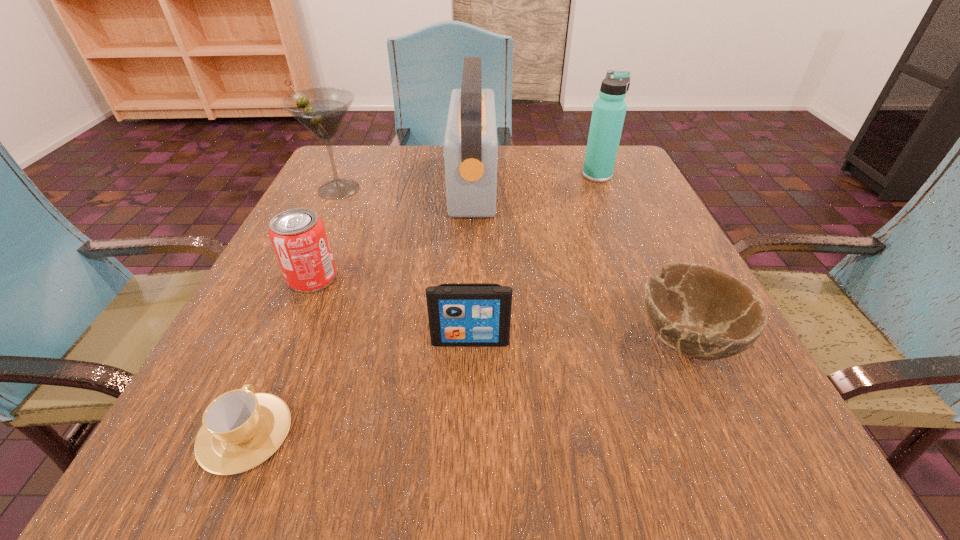
I want to click on object present at the near edge, so click(x=241, y=429).

Where is `martini situated at the left edge`? This screenshot has height=540, width=960. martini situated at the left edge is located at coordinates (322, 110).

The image size is (960, 540). In order to click on can located at the left edge in this screenshot , I will do `click(298, 236)`.

Image resolution: width=960 pixels, height=540 pixels. I want to click on cup that is positioned at the left edge, so click(x=241, y=429).

Locate an element on the screen. thermos bottle that is positioned at the right edge is located at coordinates (609, 110).

Locate an element on the screen. The width and height of the screenshot is (960, 540). bowl located at the right edge is located at coordinates (699, 311).

This screenshot has width=960, height=540. Identify the location of object that is at the far left corner. (322, 110).

Locate an element on the screen. Image resolution: width=960 pixels, height=540 pixels. object located in the near left corner section of the desktop is located at coordinates (241, 429).

You are a GUI agent. You are given a task and a screenshot of the screen. Output one action in this format:
    pyautogui.click(x=<x>, y=<y>)
    Task: Click on the object that is at the far right corner
    This screenshot has height=540, width=960.
    Given the screenshot: What is the action you would take?
    pyautogui.click(x=609, y=110)

Where is `vacant position at the far edge of the desktop`? This screenshot has height=540, width=960. vacant position at the far edge of the desktop is located at coordinates (540, 163).